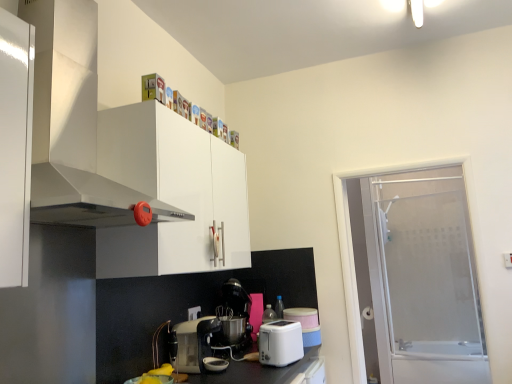
Question: From the image's perspective, is frosted glass screen door at right on white plastic electric outlet at lower center?

Choices:
 (A) yes
 (B) no

Answer: (A)

Question: Does frosted glass screen door at right have a lesser height compared to white plastic electric outlet at lower center?

Choices:
 (A) no
 (B) yes

Answer: (A)

Question: Are frosted glass screen door at right and white plastic electric outlet at lower center making contact?

Choices:
 (A) yes
 (B) no

Answer: (B)

Question: Can you confirm if frosted glass screen door at right is taller than white plastic electric outlet at lower center?

Choices:
 (A) no
 (B) yes

Answer: (B)

Question: Is frosted glass screen door at right positioned far away from white plastic electric outlet at lower center?

Choices:
 (A) yes
 (B) no

Answer: (A)

Question: Is frosted glass screen door at right bigger than white plastic electric outlet at lower center?

Choices:
 (A) no
 (B) yes

Answer: (B)

Question: From a real-world perspective, is white plastic electric outlet at lower center below metallic silver coffee maker at center, which is counted as the 1th kitchen appliance, starting from the left?

Choices:
 (A) yes
 (B) no

Answer: (B)

Question: Can you confirm if white plastic electric outlet at lower center is positioned to the left of metallic silver coffee maker at center, the 2th kitchen appliance viewed from the right?

Choices:
 (A) no
 (B) yes

Answer: (B)

Question: Does white plastic electric outlet at lower center have a lesser height compared to metallic silver coffee maker at center, which is counted as the 1th kitchen appliance, starting from the left?

Choices:
 (A) no
 (B) yes

Answer: (B)

Question: Does white plastic electric outlet at lower center appear on the right side of metallic silver coffee maker at center, which is counted as the 1th kitchen appliance, starting from the left?

Choices:
 (A) no
 (B) yes

Answer: (A)

Question: Is white plastic electric outlet at lower center bigger than metallic silver coffee maker at center, the 2th kitchen appliance viewed from the right?

Choices:
 (A) yes
 (B) no

Answer: (B)

Question: Would you consider white plastic electric outlet at lower center to be distant from metallic silver coffee maker at center, the 2th kitchen appliance viewed from the right?

Choices:
 (A) yes
 (B) no

Answer: (B)

Question: Can you confirm if frosted glass screen door at right is smaller than metallic silver coffee machine at center?

Choices:
 (A) no
 (B) yes

Answer: (A)